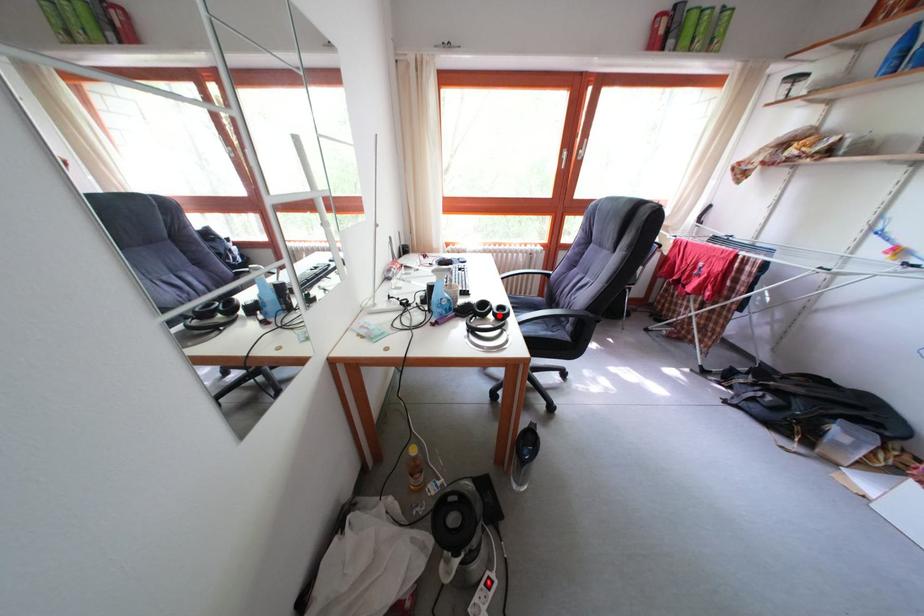
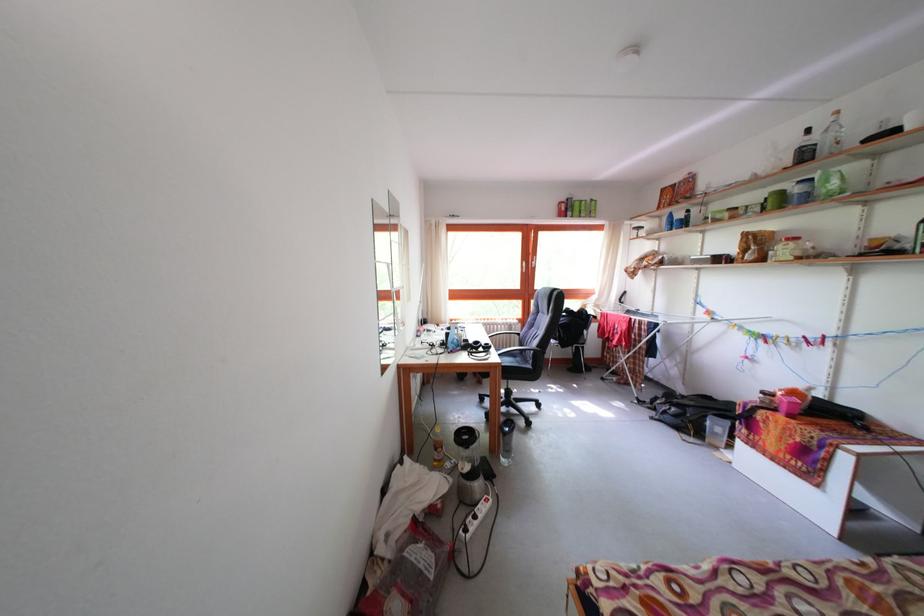
Find the pixel in the second image that matches the highlighted location in the first image.

(489, 352)